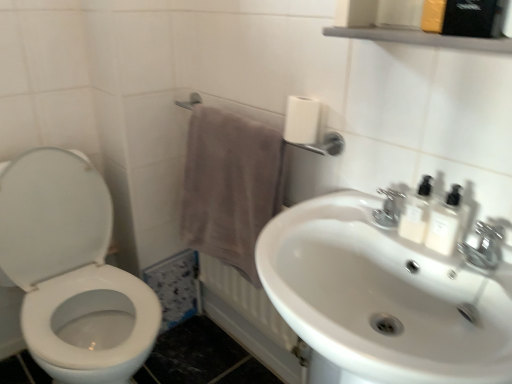
Question: Is chrome metallic faucet at upper right not inside brown fabric towel at lower center?

Choices:
 (A) yes
 (B) no

Answer: (A)

Question: Is chrome metallic faucet at upper right aimed at brown fabric towel at lower center?

Choices:
 (A) no
 (B) yes

Answer: (A)

Question: Is chrome metallic faucet at upper right further to camera compared to brown fabric towel at lower center?

Choices:
 (A) no
 (B) yes

Answer: (A)

Question: Considering the relative sizes of chrome metallic faucet at upper right and brown fabric towel at lower center in the image provided, is chrome metallic faucet at upper right wider than brown fabric towel at lower center?

Choices:
 (A) yes
 (B) no

Answer: (A)

Question: Does chrome metallic faucet at upper right appear on the right side of brown fabric towel at lower center?

Choices:
 (A) yes
 (B) no

Answer: (A)

Question: Is beige cotton towel at upper center wider or thinner than white glossy toilet at left?

Choices:
 (A) wide
 (B) thin

Answer: (B)

Question: Do you think beige cotton towel at upper center is within white glossy toilet at left, or outside of it?

Choices:
 (A) outside
 (B) inside

Answer: (A)

Question: Is beige cotton towel at upper center taller or shorter than white glossy toilet at left?

Choices:
 (A) short
 (B) tall

Answer: (A)

Question: Would you say beige cotton towel at upper center is to the left or to the right of white glossy toilet at left in the picture?

Choices:
 (A) left
 (B) right

Answer: (B)

Question: From the image's perspective, is white matte toilet paper at upper right above or below brown fabric towel at lower center?

Choices:
 (A) above
 (B) below

Answer: (A)

Question: Considering the relative positions of white matte toilet paper at upper right and brown fabric towel at lower center in the image provided, is white matte toilet paper at upper right to the left or to the right of brown fabric towel at lower center?

Choices:
 (A) right
 (B) left

Answer: (A)

Question: From a real-world perspective, relative to brown fabric towel at lower center, is white matte toilet paper at upper right vertically above or below?

Choices:
 (A) below
 (B) above

Answer: (B)

Question: Is white matte toilet paper at upper right taller or shorter than brown fabric towel at lower center?

Choices:
 (A) tall
 (B) short

Answer: (B)

Question: Is metallic gray shelf at upper center to the left or to the right of white opaque bottles at upper right, arranged as the 1th mouthwash when viewed from the right, in the image?

Choices:
 (A) left
 (B) right

Answer: (A)

Question: Looking at the image, does metallic gray shelf at upper center seem bigger or smaller compared to white opaque bottles at upper right, arranged as the 1th mouthwash when viewed from the right?

Choices:
 (A) big
 (B) small

Answer: (A)